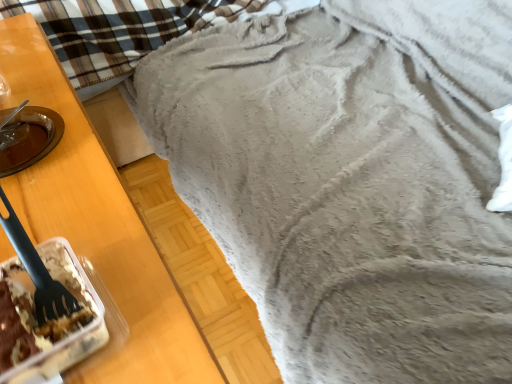
Question: From the image's perspective, is fuzzy gray blanket at upper right over translucent plastic container with cake at lower left?

Choices:
 (A) no
 (B) yes

Answer: (B)

Question: Is fuzzy gray blanket at upper right positioned with its back to translucent plastic container with cake at lower left?

Choices:
 (A) no
 (B) yes

Answer: (A)

Question: Does fuzzy gray blanket at upper right have a greater height compared to translucent plastic container with cake at lower left?

Choices:
 (A) no
 (B) yes

Answer: (B)

Question: From the image's perspective, does fuzzy gray blanket at upper right appear lower than translucent plastic container with cake at lower left?

Choices:
 (A) no
 (B) yes

Answer: (A)

Question: Is fuzzy gray blanket at upper right thinner than translucent plastic container with cake at lower left?

Choices:
 (A) no
 (B) yes

Answer: (A)

Question: In the image, is black plastic fork at left positioned in front of or behind translucent plastic container with cake at lower left?

Choices:
 (A) front
 (B) behind

Answer: (B)

Question: Would you say black plastic fork at left is to the left or to the right of translucent plastic container with cake at lower left in the picture?

Choices:
 (A) left
 (B) right

Answer: (A)

Question: From a real-world perspective, relative to translucent plastic container with cake at lower left, is black plastic fork at left vertically above or below?

Choices:
 (A) below
 (B) above

Answer: (B)

Question: Is black plastic fork at left taller or shorter than translucent plastic container with cake at lower left?

Choices:
 (A) short
 (B) tall

Answer: (B)

Question: Is fuzzy gray blanket at upper right in front of or behind black plastic fork at left in the image?

Choices:
 (A) behind
 (B) front

Answer: (B)

Question: From a real-world perspective, relative to black plastic fork at left, is fuzzy gray blanket at upper right vertically above or below?

Choices:
 (A) below
 (B) above

Answer: (A)

Question: Is fuzzy gray blanket at upper right taller or shorter than black plastic fork at left?

Choices:
 (A) short
 (B) tall

Answer: (B)

Question: Is point (31, 104) closer or farther from the camera than point (2, 220)?

Choices:
 (A) farther
 (B) closer

Answer: (A)

Question: In the image, is black plastic fork at left positioned in front of or behind fuzzy gray blanket at upper right?

Choices:
 (A) behind
 (B) front

Answer: (A)

Question: Based on their sizes in the image, would you say black plastic fork at left is bigger or smaller than fuzzy gray blanket at upper right?

Choices:
 (A) small
 (B) big

Answer: (A)